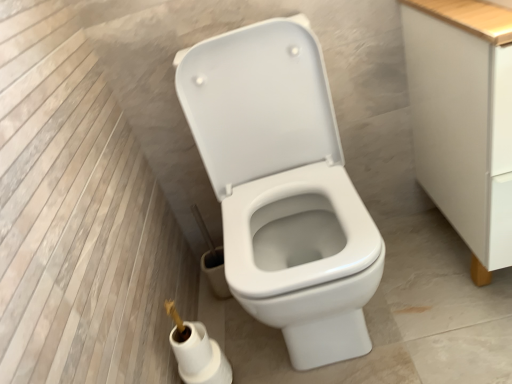
Question: Is white matte toilet paper at lower center taller than white glossy toilet at center?

Choices:
 (A) no
 (B) yes

Answer: (A)

Question: From a real-world perspective, is white matte toilet paper at lower center physically above white glossy toilet at center?

Choices:
 (A) yes
 (B) no

Answer: (B)

Question: Can you see white matte toilet paper at lower center touching white glossy toilet at center?

Choices:
 (A) no
 (B) yes

Answer: (A)

Question: Is white matte toilet paper at lower center at the right side of white glossy toilet at center?

Choices:
 (A) no
 (B) yes

Answer: (A)

Question: Would you say white matte toilet paper at lower center contains white glossy toilet at center?

Choices:
 (A) yes
 (B) no

Answer: (B)

Question: Considering the positions of white matte toilet paper at lower center and white matte cabinet at right in the image, is white matte toilet paper at lower center wider or thinner than white matte cabinet at right?

Choices:
 (A) thin
 (B) wide

Answer: (A)

Question: Looking at the image, does white matte toilet paper at lower center seem bigger or smaller compared to white matte cabinet at right?

Choices:
 (A) big
 (B) small

Answer: (B)

Question: From a real-world perspective, is white matte toilet paper at lower center positioned above or below white matte cabinet at right?

Choices:
 (A) above
 (B) below

Answer: (B)

Question: Is white matte toilet paper at lower center taller or shorter than white matte cabinet at right?

Choices:
 (A) short
 (B) tall

Answer: (A)

Question: From a real-world perspective, relative to white matte cabinet at right, is white glossy toilet at center vertically above or below?

Choices:
 (A) below
 (B) above

Answer: (B)

Question: In terms of size, does white glossy toilet at center appear bigger or smaller than white matte cabinet at right?

Choices:
 (A) small
 (B) big

Answer: (B)

Question: Does point (201, 52) appear closer or farther from the camera than point (476, 160)?

Choices:
 (A) closer
 (B) farther

Answer: (B)

Question: Considering the relative positions of white glossy toilet at center and white matte cabinet at right in the image provided, is white glossy toilet at center to the left or to the right of white matte cabinet at right?

Choices:
 (A) left
 (B) right

Answer: (A)

Question: From the image's perspective, is white matte cabinet at right above or below white glossy toilet at center?

Choices:
 (A) below
 (B) above

Answer: (B)

Question: From a real-world perspective, is white matte cabinet at right positioned above or below white glossy toilet at center?

Choices:
 (A) above
 (B) below

Answer: (B)